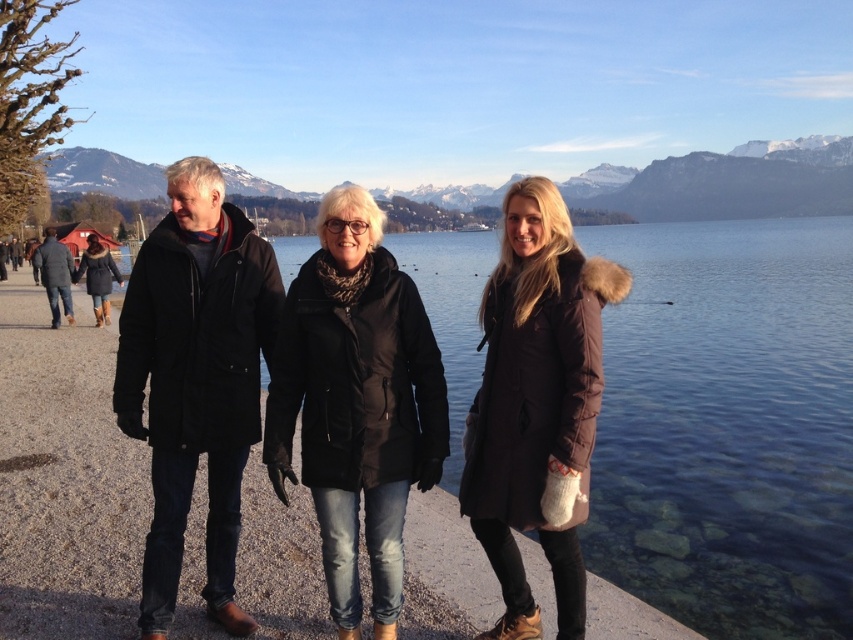
Does snowy mountain at upper center have a smaller size compared to dark gray coat at left?

No, snowy mountain at upper center is not smaller than dark gray coat at left.

Does point (706, 204) come behind point (53, 320)?

Yes, it is.

This screenshot has height=640, width=853. Describe the element at coordinates (722, 186) in the screenshot. I see `snowy mountain at upper center` at that location.

Identify the location of snowy mountain at upper center. (722, 186).

In the scene shown: Can you confirm if dark gray coat at left is positioned to the left of matte black coat at left?

Yes, dark gray coat at left is to the left of matte black coat at left.

Image resolution: width=853 pixels, height=640 pixels. In order to click on dark gray coat at left in this screenshot , I will do `click(55, 275)`.

The height and width of the screenshot is (640, 853). Identify the location of dark gray coat at left. (55, 275).

Who is more forward, (x=160, y=292) or (x=248, y=406)?

Point (x=160, y=292) is in front.

Which of these two, matte black jackets at center or black matte jacket at left, stands shorter?

With less height is matte black jackets at center.

In order to click on matte black jackets at center in this screenshot , I will do `click(279, 388)`.

At what (x,y) coordinates should I click in order to perform the action: click on matte black jackets at center. Please return your answer as a coordinate pair (x, y). The image size is (853, 640). Looking at the image, I should click on (279, 388).